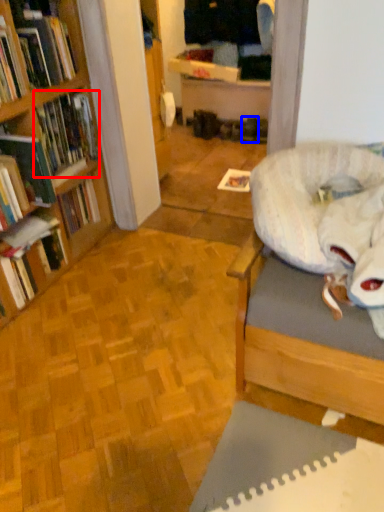
Question: Which point is closer to the camera, book (highlighted by a red box) or footwear (highlighted by a blue box)?

Choices:
 (A) book
 (B) footwear

Answer: (A)